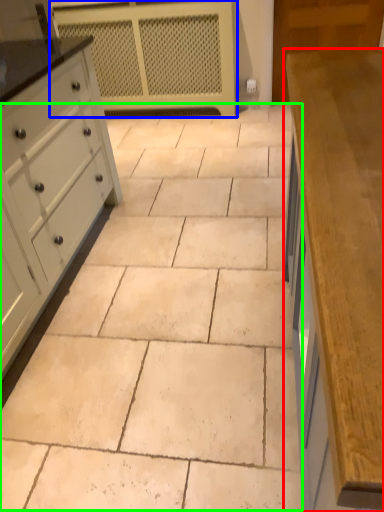
Question: Considering the real-world distances, which object is farthest from countertop (highlighted by a red box)? appliance (highlighted by a blue box) or ceramic tile (highlighted by a green box)?

Choices:
 (A) appliance
 (B) ceramic tile

Answer: (A)